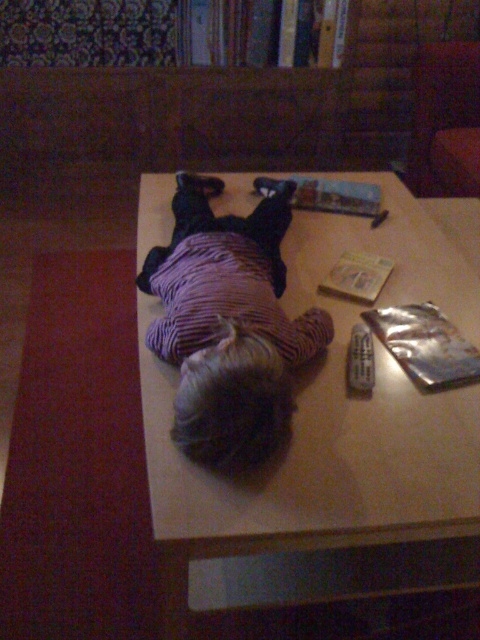
You are a photographer taking a picture of the wooden table at center and the purple corduroy shirt at center. Which object should you focus on first if you want to ensure both are in focus?

The wooden table at center is below the purple corduroy shirt at center, so you should focus on the purple corduroy shirt at center first to ensure both are in focus.

You are trying to place a rectangular gift box that is 1.2 meters long on the wooden table at center. Considering the purple corduroy shirt at center is already occupying part of the table, can the gift box fit on the table without overlapping the shirt?

The wooden table at center is wider than the purple corduroy shirt at center, so the gift box can be placed on the table in a direction perpendicular to its length, ensuring it doesn not overlap the shirt.

You are trying to reach the black plastic remote at center from the purple corduroy shirt at center. Considering their sizes, which object would be easier to grab first?

The purple corduroy shirt at center has a larger size compared to the black plastic remote at center, so it would be easier to grab first because it has a bigger surface area to hold onto.